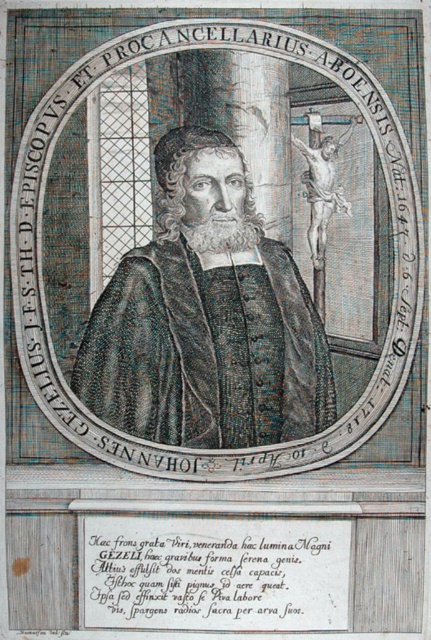
Question: Which object appears farthest from the camera in this image?

Choices:
 (A) black textured robe at center
 (B) black paper text at lower center

Answer: (B)

Question: Which point is closer to the camera?

Choices:
 (A) black paper text at lower center
 (B) black textured robe at center

Answer: (B)

Question: Does black textured robe at center appear under black paper text at lower center?

Choices:
 (A) yes
 (B) no

Answer: (B)

Question: Is black textured robe at center above black paper text at lower center?

Choices:
 (A) yes
 (B) no

Answer: (A)

Question: From the image, what is the correct spatial relationship of black textured robe at center in relation to black paper text at lower center?

Choices:
 (A) left
 (B) right

Answer: (A)